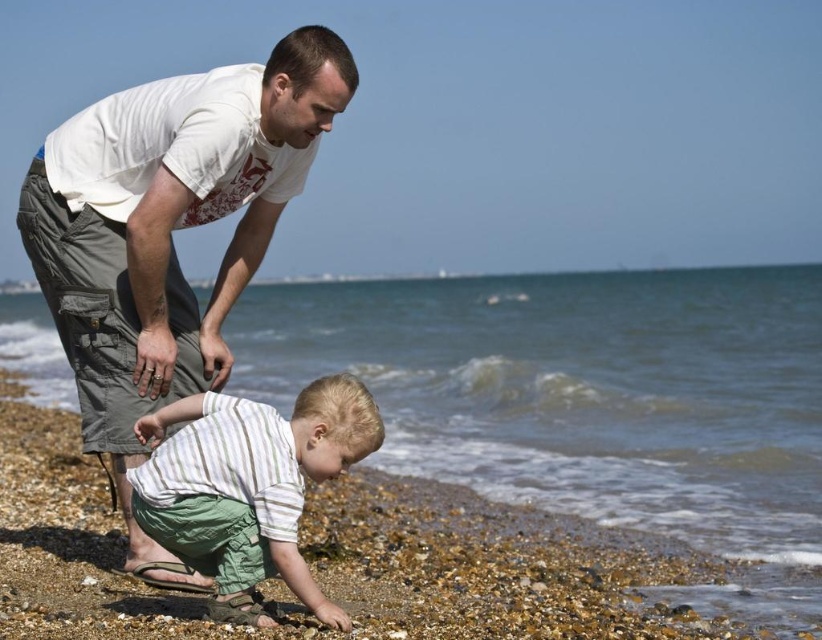
You are a photographer trying to capture the father and son at the beach. You want to ensure that both the smooth pebbles at lower center and the striped cotton shirt at lower center are clearly visible in your shot. Which object should you focus on first to ensure clarity, considering their sizes?

The smooth pebbles at lower center should be focused on first because they are larger in size than the striped cotton shirt at lower center, making them easier to capture clearly.